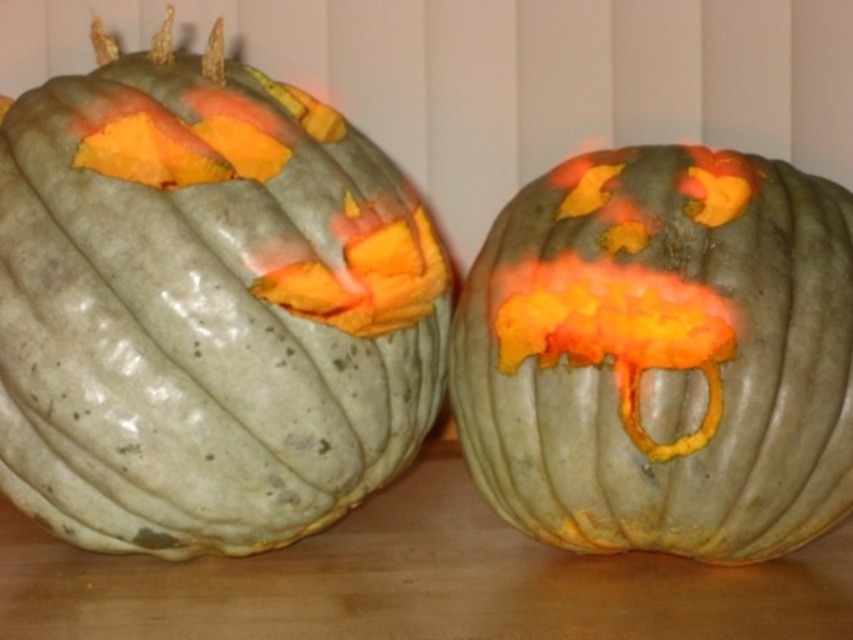
Question: Does matte green pumpkin at left have a lesser width compared to matte gray pumpkin at center?

Choices:
 (A) no
 (B) yes

Answer: (A)

Question: Does matte green pumpkin at left have a larger size compared to matte gray pumpkin at center?

Choices:
 (A) yes
 (B) no

Answer: (A)

Question: Is matte green pumpkin at left to the right of matte gray pumpkin at center from the viewer's perspective?

Choices:
 (A) yes
 (B) no

Answer: (B)

Question: Which point appears closest to the camera in this image?

Choices:
 (A) (250, 241)
 (B) (724, 324)

Answer: (B)

Question: Which object is farther from the camera taking this photo?

Choices:
 (A) matte gray pumpkin at center
 (B) matte green pumpkin at left

Answer: (A)